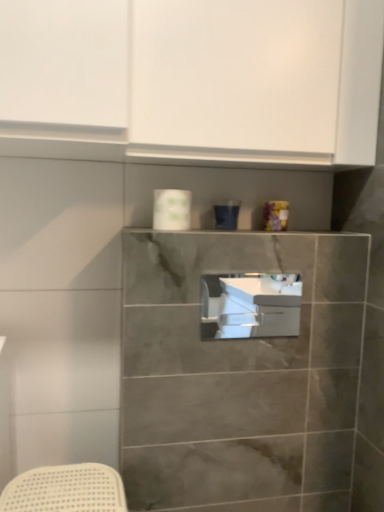
Question: From a real-world perspective, relative to white matte cabinet at upper center, is white glossy toilet paper at upper center vertically above or below?

Choices:
 (A) below
 (B) above

Answer: (A)

Question: From the image's perspective, relative to white matte cabinet at upper center, is white glossy toilet paper at upper center above or below?

Choices:
 (A) below
 (B) above

Answer: (A)

Question: Estimate the real-world distances between objects in this image. Which object is farther from the white glossy toilet paper at upper center?

Choices:
 (A) white matte cabinet at upper center
 (B) white glossy sink at center

Answer: (B)

Question: Estimate the real-world distances between objects in this image. Which object is closer to the white glossy toilet paper at upper center?

Choices:
 (A) white glossy sink at center
 (B) white matte cabinet at upper center

Answer: (B)